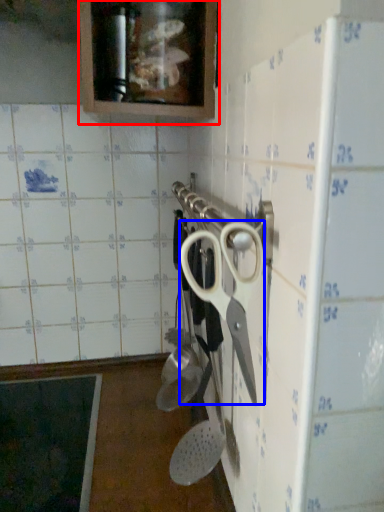
Question: Which object is further to the camera taking this photo, cabinetry (highlighted by a red box) or scissors (highlighted by a blue box)?

Choices:
 (A) cabinetry
 (B) scissors

Answer: (A)